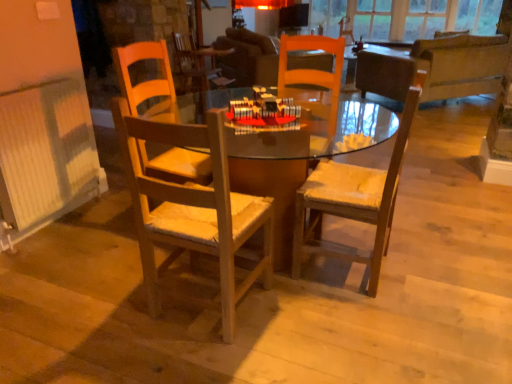
Locate an element on the screen. The image size is (512, 384). vacant space that is in between wooden chair at center, the 1th chair viewed from the left, and wooden table at center is located at coordinates (217, 324).